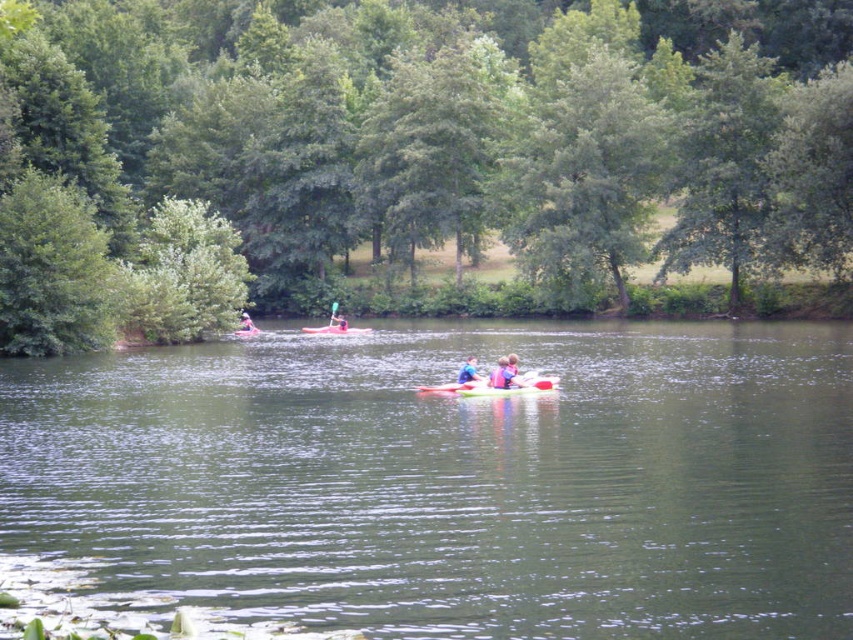
Question: In this image, where is rubber paddle at center located relative to green plastic paddle at center?

Choices:
 (A) right
 (B) left

Answer: (A)

Question: Does pink fabric kayak at center have a lesser width compared to green plastic paddle at center?

Choices:
 (A) no
 (B) yes

Answer: (B)

Question: Among these points, which one is farthest from the camera?

Choices:
 (A) (433, 385)
 (B) (469, 365)
 (C) (248, 330)

Answer: (C)

Question: Which object is farther from the camera taking this photo?

Choices:
 (A) pink fabric kayak at center
 (B) green smooth water at center
 (C) rubber paddle at center

Answer: (A)

Question: Considering the real-world distances, which object is farthest from the blue fabric kayak at center?

Choices:
 (A) blue fabric person at center
 (B) matte pink kayak at center
 (C) green smooth water at center
 (D) pink fabric kayak at center

Answer: (B)

Question: Does blue fabric kayak at center appear over matte pink kayak at center?

Choices:
 (A) yes
 (B) no

Answer: (B)